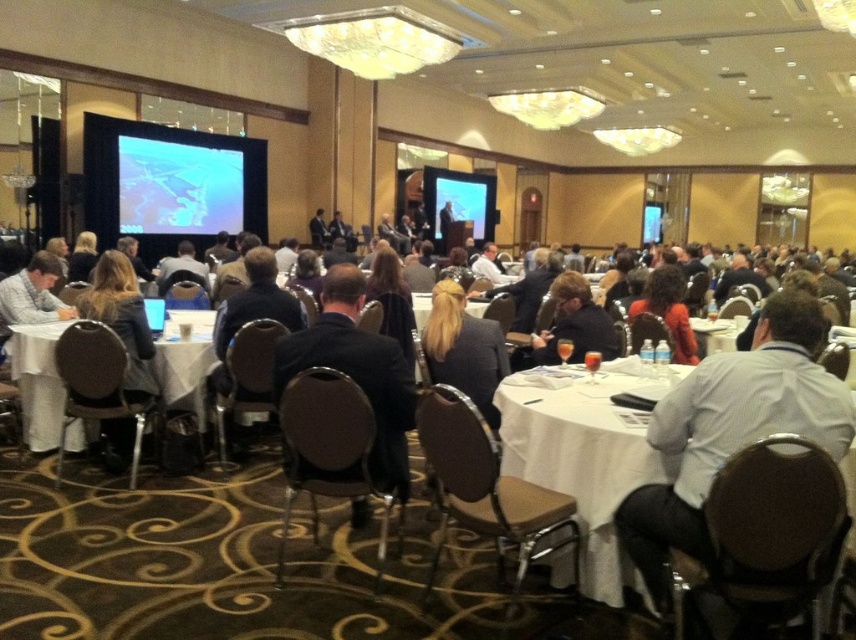
Question: Which point is closer to the camera taking this photo?

Choices:
 (A) (623, 570)
 (B) (455, 356)

Answer: (A)

Question: Does dark suit at center come behind white cloth table at lower left?

Choices:
 (A) yes
 (B) no

Answer: (B)

Question: Which is farther from the white cloth table at lower left?

Choices:
 (A) dark brown hair at center
 (B) dark suit at center
 (C) light gray shirt at left

Answer: (A)

Question: Estimate the real-world distances between objects in this image. Which object is farther from the light gray shirt at left?

Choices:
 (A) dark brown hair at center
 (B) dark brown leather jacket at center
 (C) white shirt at right

Answer: (A)

Question: Is dark suit at center positioned at the back of dark brown leather jacket at center?

Choices:
 (A) no
 (B) yes

Answer: (A)

Question: Can you confirm if dark gray suit at center is positioned above dark brown leather jacket at center?

Choices:
 (A) no
 (B) yes

Answer: (A)